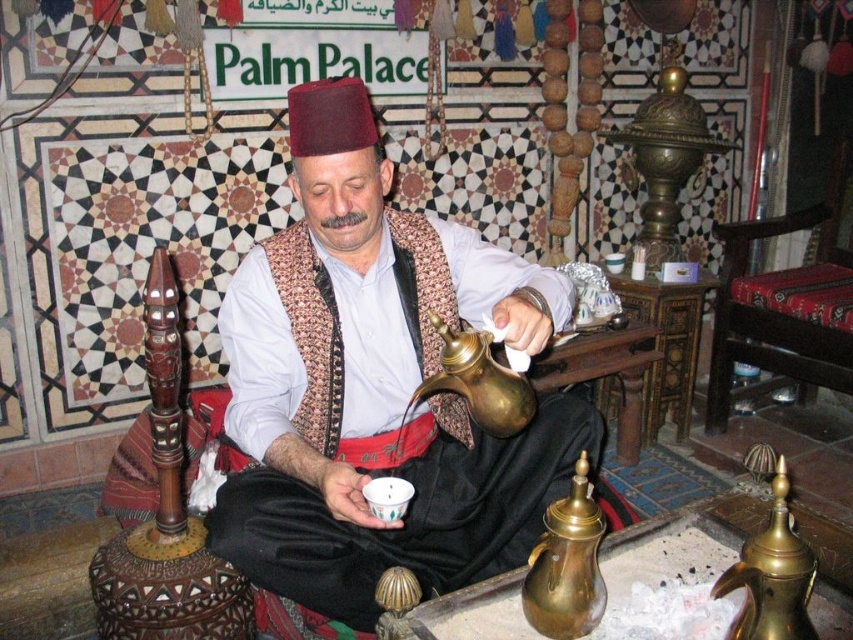
Can you confirm if matte gold teapot at center is positioned below brass teapot at lower center?

Incorrect, matte gold teapot at center is not positioned below brass teapot at lower center.

Is point (378, 189) less distant than point (590, 522)?

That is False.

At what (x,y) coordinates should I click in order to perform the action: click on matte gold teapot at center. Please return your answer as a coordinate pair (x, y). The width and height of the screenshot is (853, 640). Looking at the image, I should click on (376, 385).

Can you confirm if matte gold teapot at center is smaller than brass teapot at lower right?

No, matte gold teapot at center is not smaller than brass teapot at lower right.

Is point (289, 573) less distant than point (788, 570)?

No, it is behind (788, 570).

Locate an element on the screen. The height and width of the screenshot is (640, 853). matte gold teapot at center is located at coordinates (376, 385).

Between brass teapot at lower center and brass teapot at lower right, which one is positioned lower?

Positioned lower is brass teapot at lower center.

Is brass teapot at lower center positioned before brass teapot at lower right?

That is False.

Describe the element at coordinates (566, 564) in the screenshot. I see `brass teapot at lower center` at that location.

You are a GUI agent. You are given a task and a screenshot of the screen. Output one action in this format:
    pyautogui.click(x=<x>, y=<y>)
    Task: Click on the brass teapot at lower center
    This screenshot has width=853, height=640.
    Given the screenshot: What is the action you would take?
    pyautogui.click(x=566, y=564)